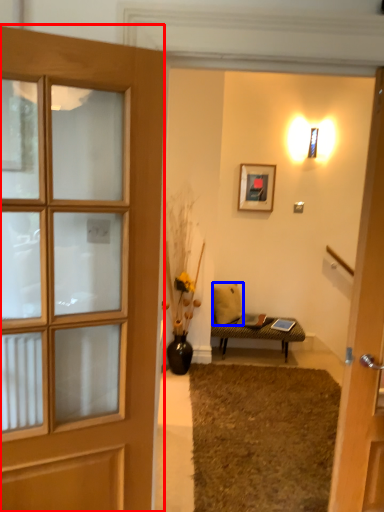
Question: Which object appears closest to the camera in this image, door (highlighted by a red box) or pillow (highlighted by a blue box)?

Choices:
 (A) door
 (B) pillow

Answer: (A)